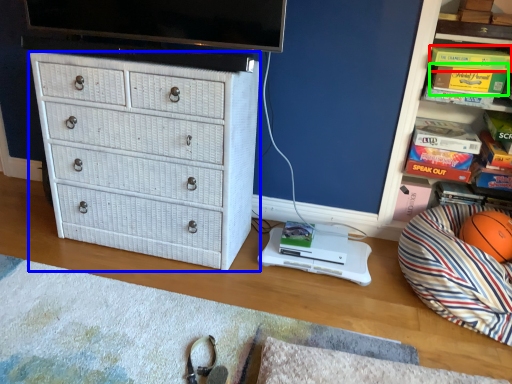
Question: Which object is the closest to the book (highlighted by a red box)? Choose among these: chest of drawers (highlighted by a blue box) or magazine (highlighted by a green box).

Choices:
 (A) chest of drawers
 (B) magazine

Answer: (B)